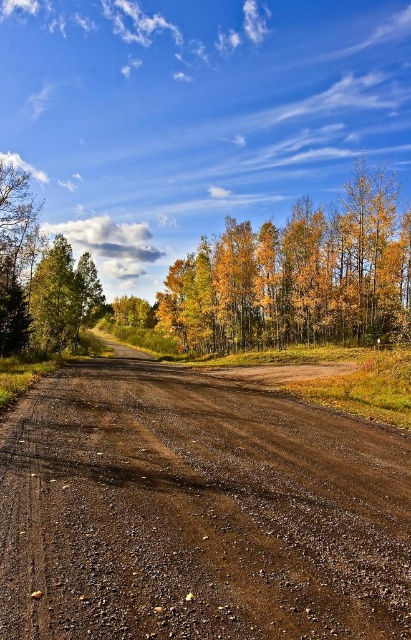
Question: In this image, where is brown gravel road at center located relative to golden leaves forest at center?

Choices:
 (A) left
 (B) right

Answer: (B)

Question: Is brown gravel road at center behind golden leaves forest at center?

Choices:
 (A) no
 (B) yes

Answer: (A)

Question: Which object appears closest to the camera in this image?

Choices:
 (A) brown gravel road at center
 (B) golden leaves forest at center

Answer: (A)

Question: Is brown gravel road at center positioned at the back of golden leaves forest at center?

Choices:
 (A) yes
 (B) no

Answer: (B)